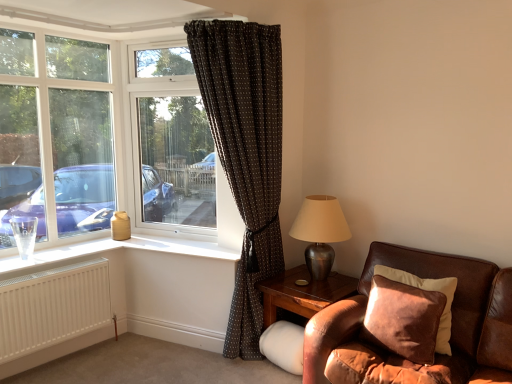
Question: Is white plastic window frame at left taller than metallic silver table lamp at right?

Choices:
 (A) no
 (B) yes

Answer: (B)

Question: Is white plastic window frame at left smaller than metallic silver table lamp at right?

Choices:
 (A) yes
 (B) no

Answer: (A)

Question: From a real-world perspective, is white plastic window frame at left located higher than metallic silver table lamp at right?

Choices:
 (A) yes
 (B) no

Answer: (A)

Question: Is white plastic window frame at left to the left of metallic silver table lamp at right from the viewer's perspective?

Choices:
 (A) yes
 (B) no

Answer: (A)

Question: From the image's perspective, is white plastic window frame at left located above metallic silver table lamp at right?

Choices:
 (A) no
 (B) yes

Answer: (B)

Question: Considering the positions of white plastic window frame at left and white matte radiator at lower left in the image, is white plastic window frame at left wider or thinner than white matte radiator at lower left?

Choices:
 (A) thin
 (B) wide

Answer: (A)

Question: Considering the relative positions of white plastic window frame at left and white matte radiator at lower left in the image provided, is white plastic window frame at left to the left or to the right of white matte radiator at lower left?

Choices:
 (A) left
 (B) right

Answer: (A)

Question: From a real-world perspective, is white plastic window frame at left positioned above or below white matte radiator at lower left?

Choices:
 (A) below
 (B) above

Answer: (B)

Question: Choose the correct answer: Is white plastic window frame at left inside white matte radiator at lower left or outside it?

Choices:
 (A) inside
 (B) outside

Answer: (B)

Question: In terms of size, does white matte radiator at lower left appear bigger or smaller than brown corduroy pillow at lower right?

Choices:
 (A) small
 (B) big

Answer: (B)

Question: In terms of width, does white matte radiator at lower left look wider or thinner when compared to brown corduroy pillow at lower right?

Choices:
 (A) wide
 (B) thin

Answer: (B)

Question: From a real-world perspective, is white matte radiator at lower left physically located above or below brown corduroy pillow at lower right?

Choices:
 (A) above
 (B) below

Answer: (B)

Question: From the image's perspective, relative to brown corduroy pillow at lower right, is white matte radiator at lower left above or below?

Choices:
 (A) above
 (B) below

Answer: (B)

Question: From a real-world perspective, is brown leather couch at lower right physically located above or below brown corduroy pillow at lower right?

Choices:
 (A) below
 (B) above

Answer: (A)

Question: From the image's perspective, is brown leather couch at lower right located above or below brown corduroy pillow at lower right?

Choices:
 (A) above
 (B) below

Answer: (B)